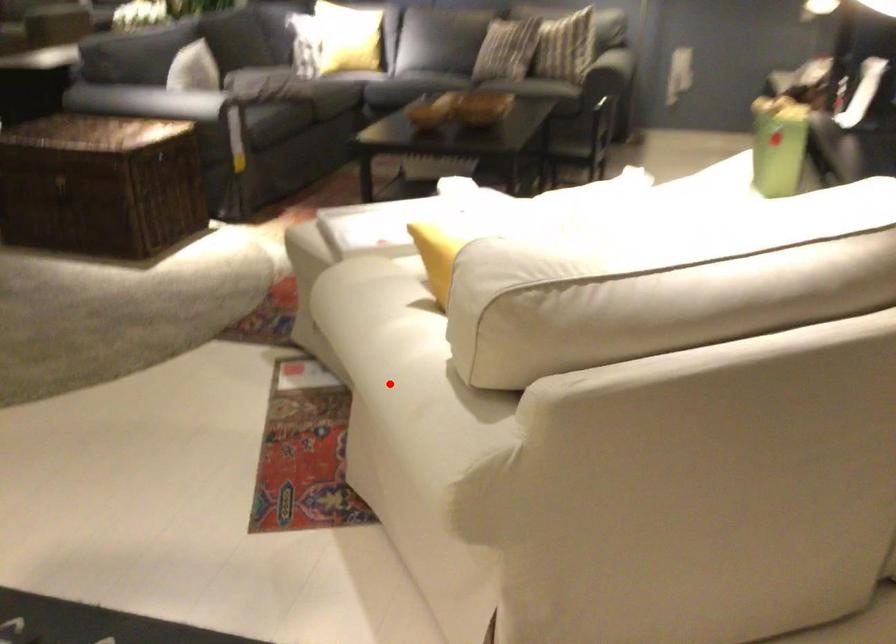
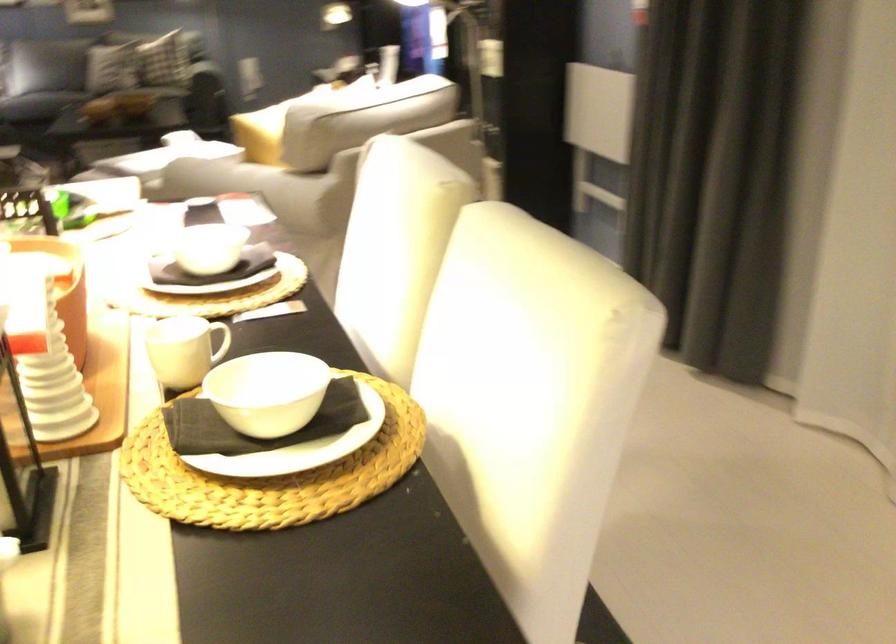
Find the pixel in the second image that matches the highlighted location in the first image.

(264, 185)